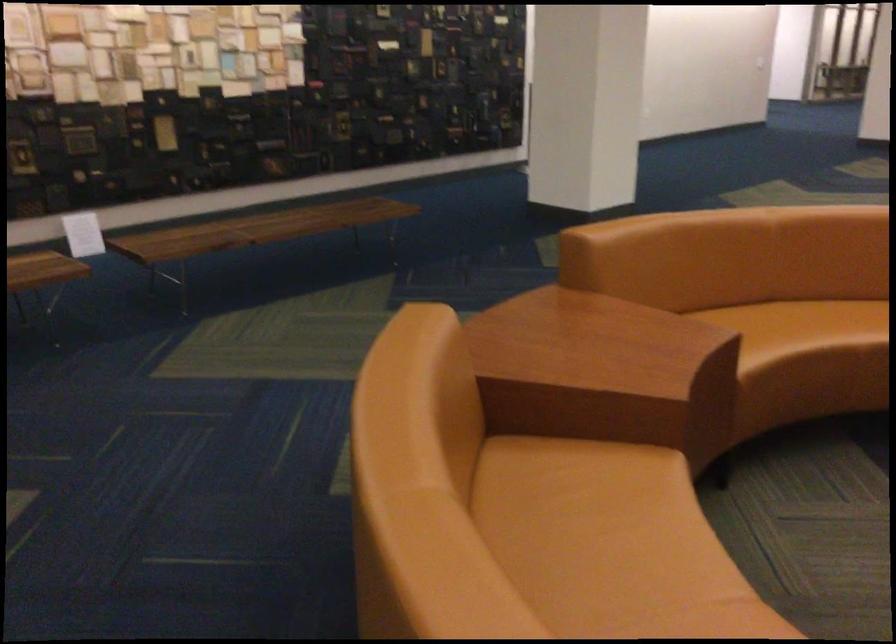
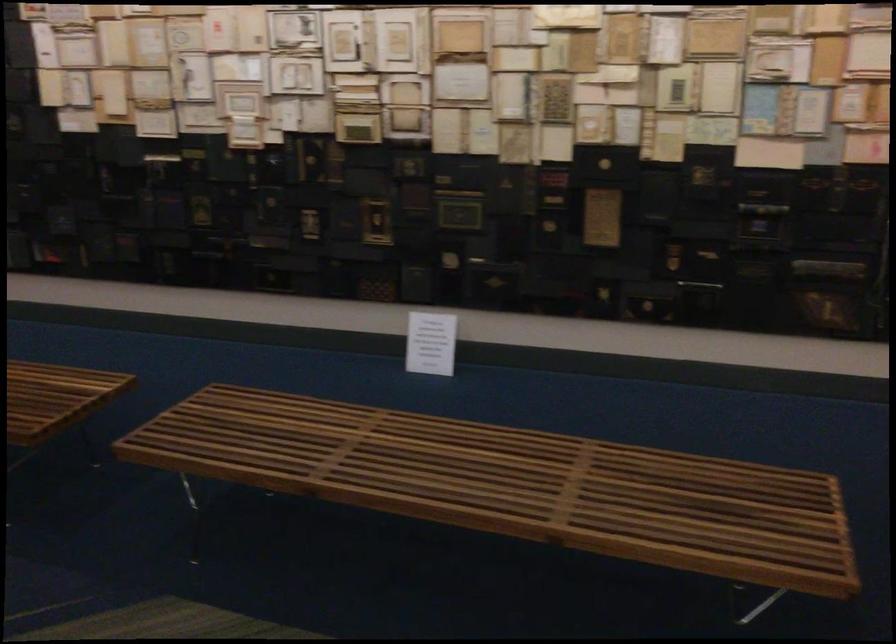
In the second image, find the point that corresponds to pixel 82 236 in the first image.

(431, 343)